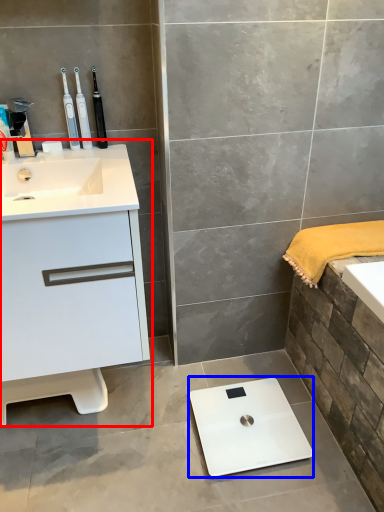
Question: Which object is closer to the camera taking this photo, bathroom cabinet (highlighted by a red box) or scale (highlighted by a blue box)?

Choices:
 (A) bathroom cabinet
 (B) scale

Answer: (A)